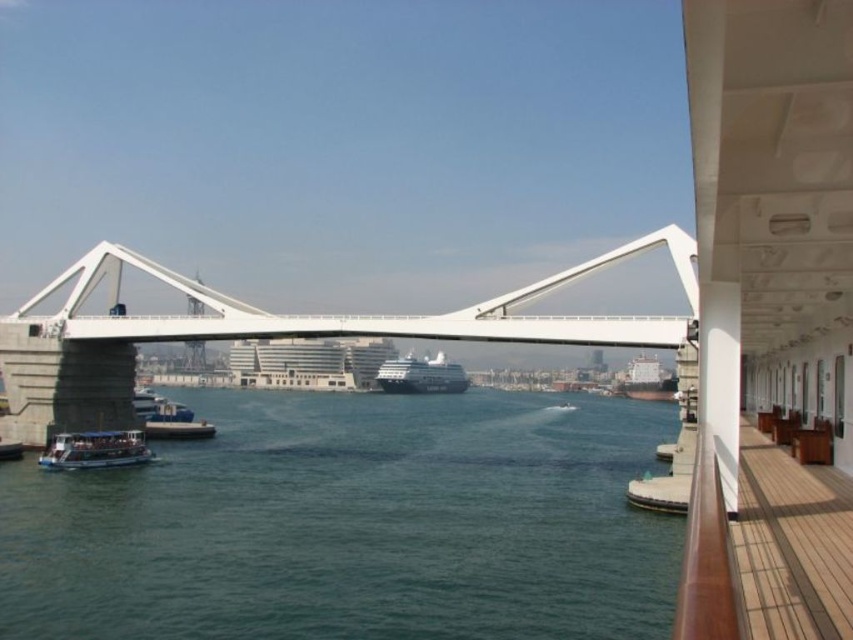
You are standing on the deck of a cruise ship and see the white metallic bridge at center and the green matte boat at lower left. Which object is taller?

The white metallic bridge at center is taller than the green matte boat at lower left.

You are standing on the deck of a cruise ship and want to take a photo of the white metallic bridge at center. What are the coordinates where you should aim your camera to capture it?

The white metallic bridge at center is located at coordinates point (x=267, y=332), so you should aim your camera there to capture it.